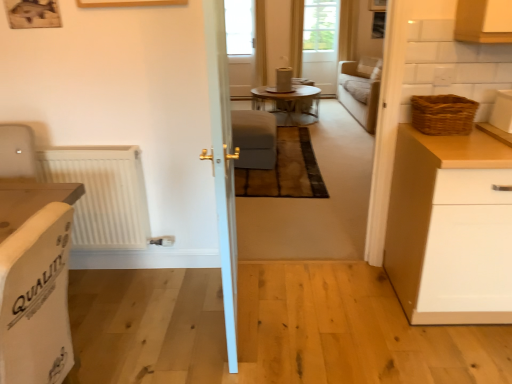
This screenshot has width=512, height=384. I want to click on space that is in front of white glossy door at center, so click(x=227, y=351).